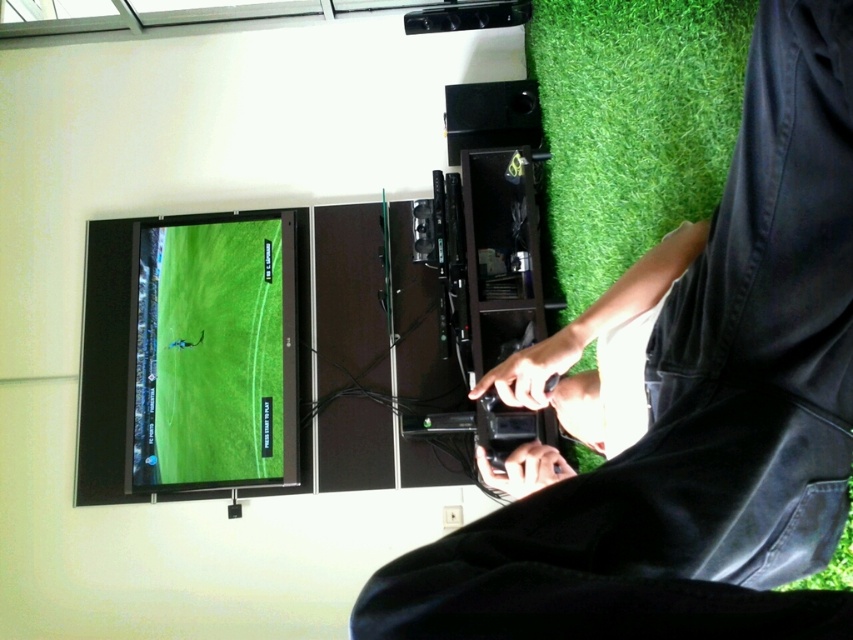
Question: Which point is farther to the camera?

Choices:
 (A) black matte controller at lower center
 (B) green matte screen at left
 (C) black matte pants at lower right

Answer: (B)

Question: Does black matte pants at lower right have a smaller size compared to green matte screen at left?

Choices:
 (A) no
 (B) yes

Answer: (A)

Question: Can you confirm if black matte pants at lower right is positioned to the left of green matte screen at left?

Choices:
 (A) yes
 (B) no

Answer: (B)

Question: Does black matte pants at lower right appear under green matte screen at left?

Choices:
 (A) yes
 (B) no

Answer: (B)

Question: Which of the following is the farthest from the observer?

Choices:
 (A) (635, 307)
 (B) (166, 444)

Answer: (B)

Question: Which of the following is the farthest from the observer?

Choices:
 (A) (515, 397)
 (B) (131, 385)

Answer: (B)